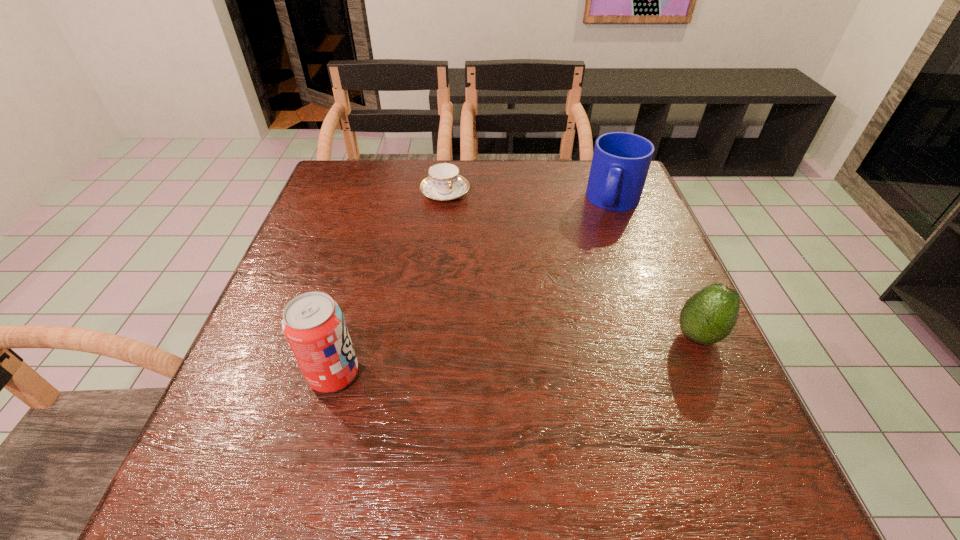
Identify the location of vacant region located on the side with the handle of the mug. (583, 299).

The width and height of the screenshot is (960, 540). I want to click on vacant region located 0.240m on the side with the handle of the mug, so click(x=589, y=281).

Identify the location of vacant area located on the side with the handle of the mug. This screenshot has height=540, width=960. (595, 265).

You are a GUI agent. You are given a task and a screenshot of the screen. Output one action in this format:
    pyautogui.click(x=<x>, y=<y>)
    Task: Click on the teacup that is at the far edge
    The height and width of the screenshot is (540, 960).
    Given the screenshot: What is the action you would take?
    pyautogui.click(x=444, y=183)

Image resolution: width=960 pixels, height=540 pixels. In order to click on mug at the far edge in this screenshot , I will do `click(620, 164)`.

Where is `object at the near edge`? object at the near edge is located at coordinates (313, 323).

The height and width of the screenshot is (540, 960). I want to click on object present at the left edge, so click(313, 323).

I want to click on avocado that is at the right edge, so click(x=708, y=316).

The image size is (960, 540). I want to click on mug at the right edge, so click(620, 164).

At what (x,y) coordinates should I click in order to perform the action: click on object located in the near left corner section of the desktop. Please return your answer as a coordinate pair (x, y). The height and width of the screenshot is (540, 960). Looking at the image, I should click on (313, 323).